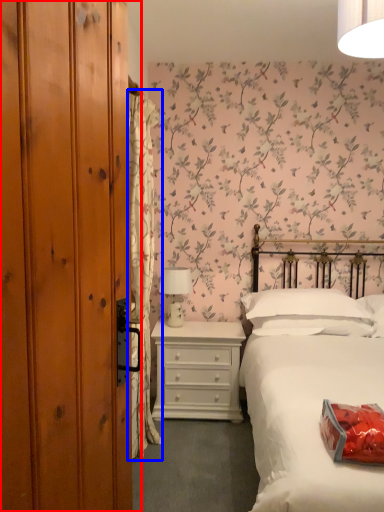
Question: Which point is closer to the camera, dresser (highlighted by a red box) or curtain (highlighted by a blue box)?

Choices:
 (A) dresser
 (B) curtain

Answer: (A)